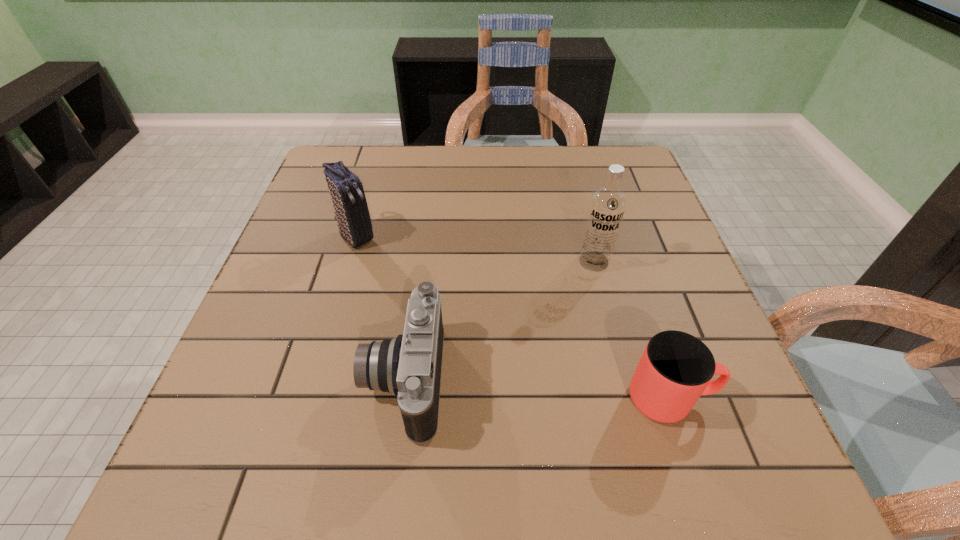
Where is `vacant space on the desktop that is between the third tallest object and the cup and is positioned on the front label of the vodka`? vacant space on the desktop that is between the third tallest object and the cup and is positioned on the front label of the vodka is located at coordinates pyautogui.click(x=535, y=389).

In order to click on free space on the desktop that is between the third object from right to left and the cup and is positioned with the zip open on the clutch bag in this screenshot , I will do `click(508, 387)`.